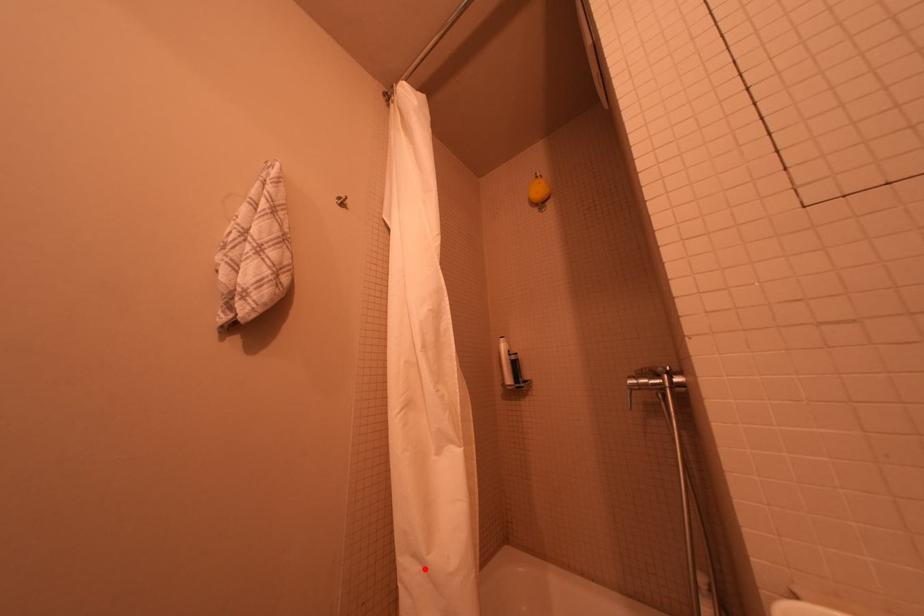
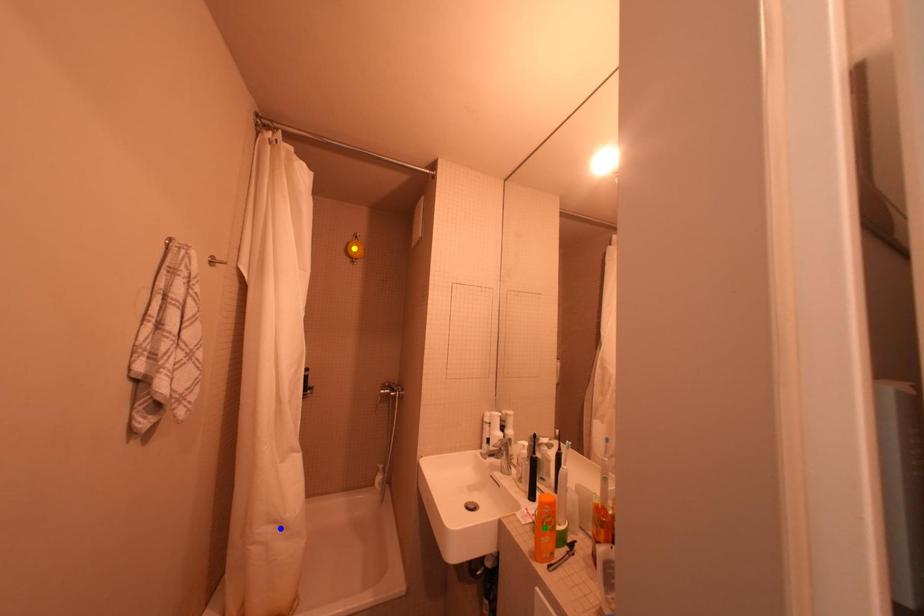
Question: I am providing you with two images of the same scene from different viewpoints. A red point is marked on the first image. You are given multiple points on the second image. Can you choose the point in image 2 that corresponds to the point in image 1?

Choices:
 (A) green point
 (B) blue point
 (C) yellow point

Answer: (B)